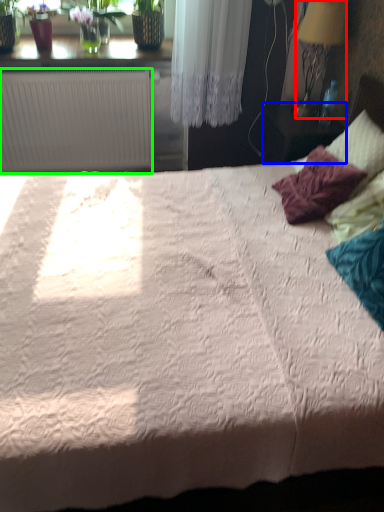
Question: Based on their relative distances, which object is nearer to lamp (highlighted by a red box)? Choose from table (highlighted by a blue box) and radiator (highlighted by a green box).

Choices:
 (A) table
 (B) radiator

Answer: (A)